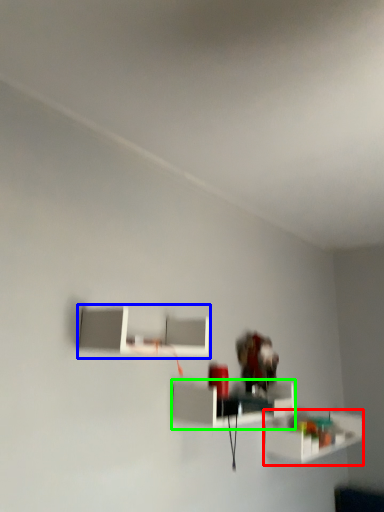
Question: Which object is the farthest from shelf (highlighted by a red box)? Choose among these: shelf (highlighted by a blue box) or shelf (highlighted by a green box).

Choices:
 (A) shelf
 (B) shelf

Answer: (A)